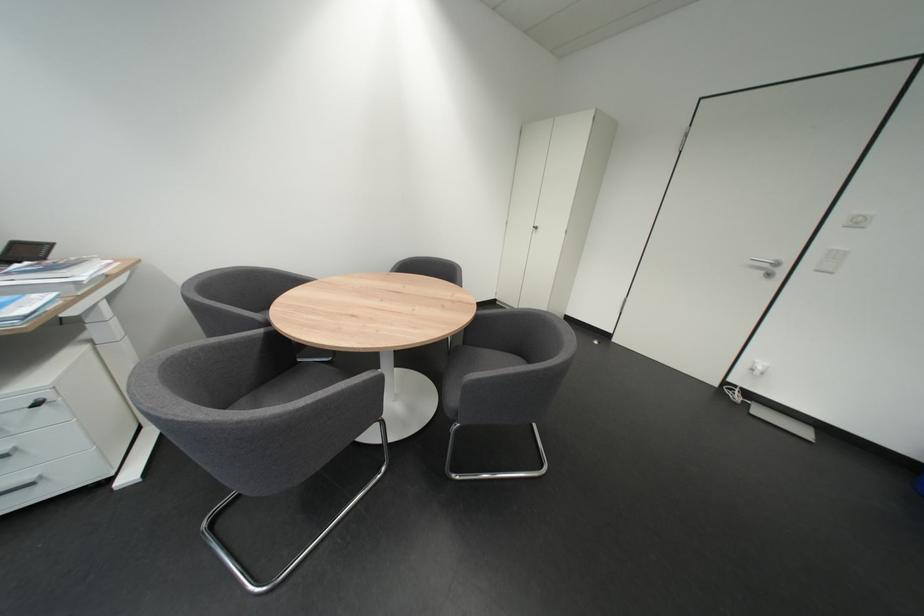
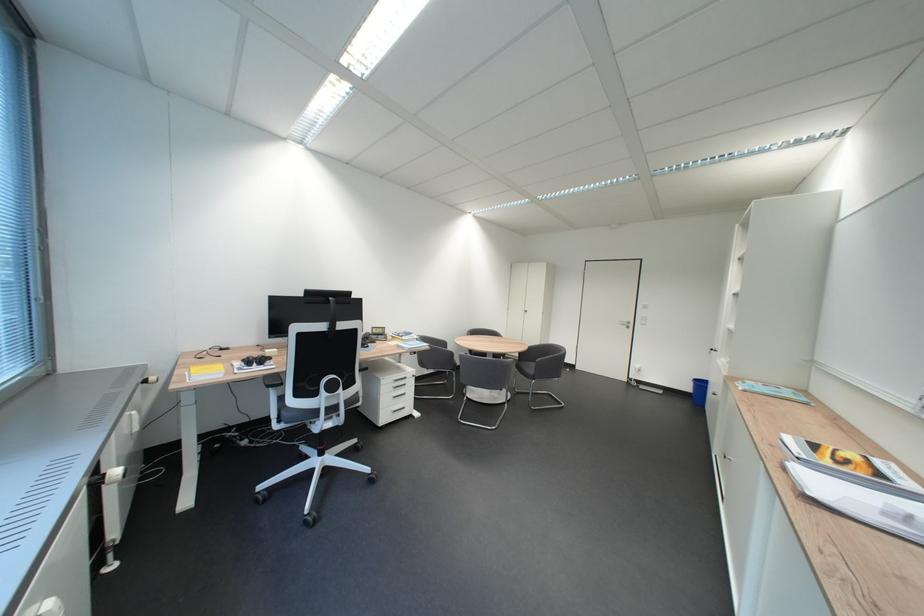
What movement of the cameraman would produce the second image?

The movement direction of the cameraman is left, backward.